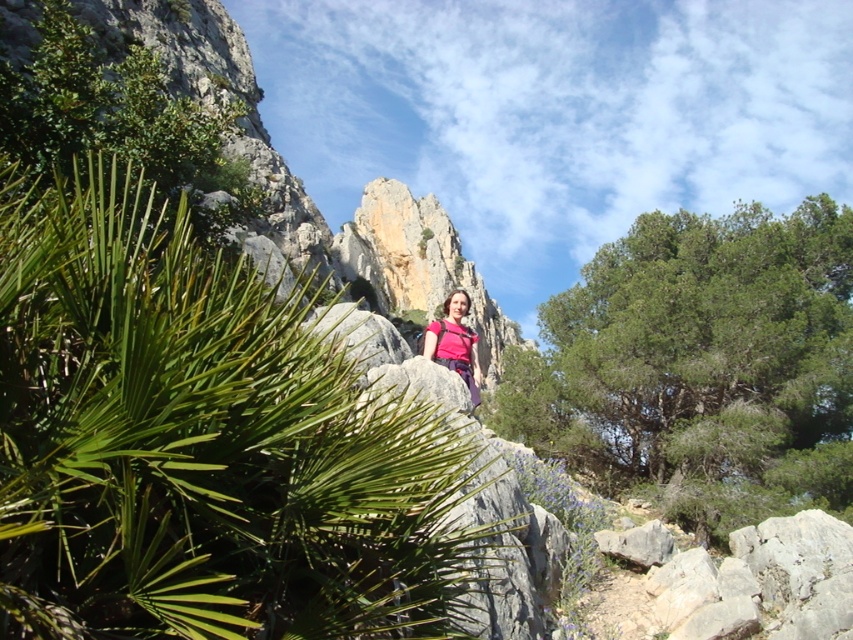
You are a hiker who wants to take a photo of the green leafy plant at center and the green leafy tree at center. Can you fit both in your camera frame if your camera can capture a maximum distance of 40 meters between objects?

The green leafy plant at center and green leafy tree at center are 39.60 meters apart, which is just under the camera frame limit of 40 meters. Yes, both can be captured in the same photo.

You are a photographer planning to take a photo of the green leafy plant at center and the pink fabric at center. To ensure both are in the frame, should you position yourself to the left or right of the scene?

To capture both the green leafy plant at center and the pink fabric at center in the frame, you should position yourself to the right of the scene. This is because the green leafy plant at center is located to the left of the pink fabric at center, so positioning yourself to the right will allow both objects to be included in the photo.

You are standing at point A located at point (786, 248). You want to reach point B, which is 70.57 meters away from you. Is there a clear path between you and point B, considering the rocky terrain and large boulders in the middle ground?

The path between point A located at point (786, 248) and point B is obstructed by the rocky terrain and large boulders in the middle ground, so there is no clear path between them.